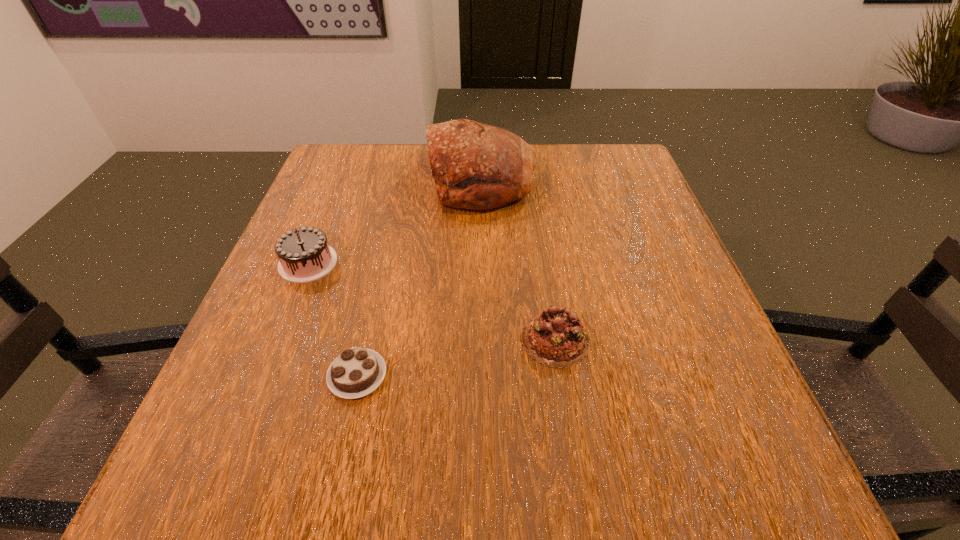
I want to click on vacant space at the far left corner, so click(x=377, y=192).

Identify the location of free region at the near left corner. This screenshot has height=540, width=960. (278, 470).

Where is `vacant region at the far right corner of the desktop`? vacant region at the far right corner of the desktop is located at coordinates (585, 184).

In order to click on free space between the second chocolate cake from right to left and the second shortest object in this screenshot , I will do `click(456, 357)`.

I want to click on empty location between the third shortest object and the bread, so click(395, 222).

Locate an element on the screen. The height and width of the screenshot is (540, 960). empty location between the third tallest object and the third shortest object is located at coordinates (431, 301).

Image resolution: width=960 pixels, height=540 pixels. I want to click on unoccupied area between the third tallest object and the tallest object, so 518,260.

The width and height of the screenshot is (960, 540). What are the coordinates of `free spot between the second chocolate cake from right to left and the second farthest object` in the screenshot? It's located at (333, 319).

The image size is (960, 540). I want to click on vacant space that is in between the tallest object and the second tallest chocolate cake, so click(x=518, y=260).

In order to click on free space between the leftmost object and the shortest chocolate cake in this screenshot , I will do `click(333, 319)`.